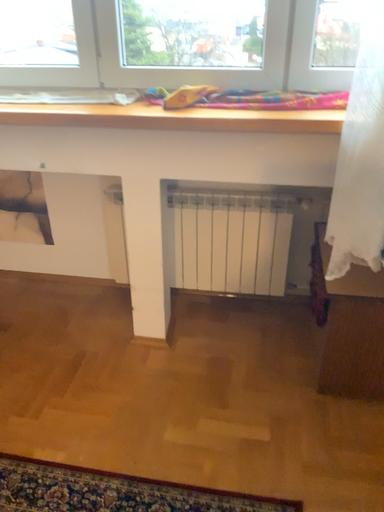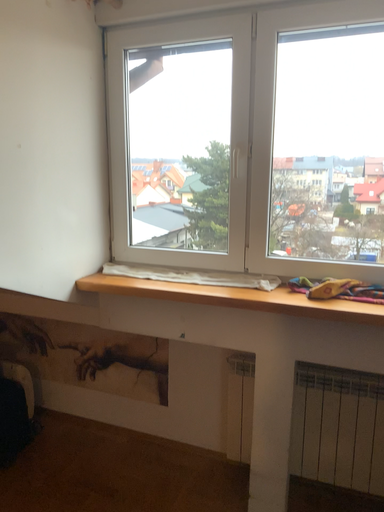
Question: How did the camera likely rotate when shooting the video?

Choices:
 (A) rotated right
 (B) rotated left

Answer: (B)